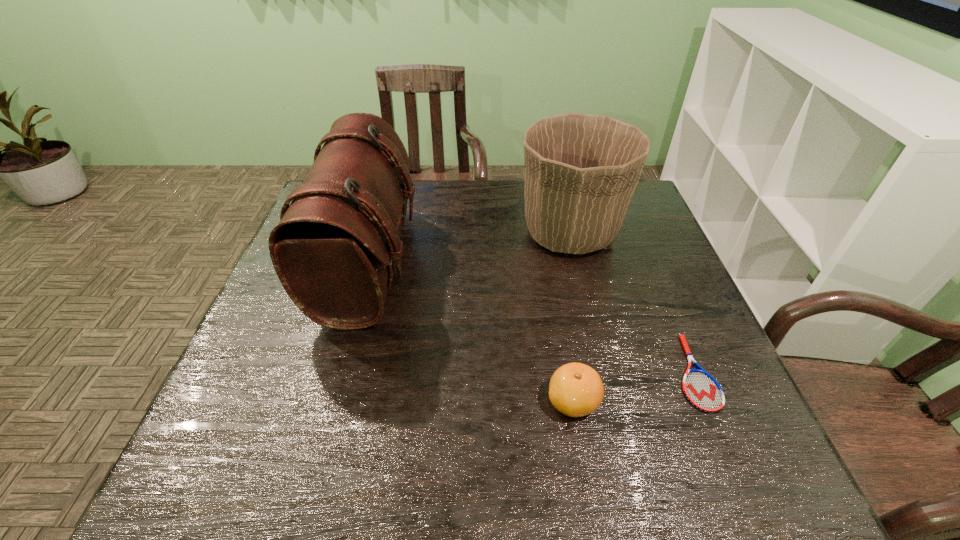
Find the location of a particular element. The height and width of the screenshot is (540, 960). empty location between the satchel and the tennis racket is located at coordinates (531, 319).

What are the coordinates of `unoccupied area between the satchel and the third tallest object` in the screenshot? It's located at (470, 333).

Where is `unoccupied area between the leftmost object and the flowerpot`? This screenshot has width=960, height=540. unoccupied area between the leftmost object and the flowerpot is located at coordinates (469, 248).

Where is `vacant space in between the leftmost object and the third tallest object`? vacant space in between the leftmost object and the third tallest object is located at coordinates (470, 333).

Find the location of `unoccupied position between the leftmost object and the tennis racket`. unoccupied position between the leftmost object and the tennis racket is located at coordinates (531, 319).

At what (x,y) coordinates should I click in order to perform the action: click on vacant space that's between the leftmost object and the clementine. Please return your answer as a coordinate pair (x, y). Looking at the image, I should click on (470, 333).

At what (x,y) coordinates should I click in order to perform the action: click on free space between the satchel and the second shortest object. Please return your answer as a coordinate pair (x, y). Looking at the image, I should click on (470, 333).

The height and width of the screenshot is (540, 960). Find the location of `empty space that is in between the flowerpot and the shortest object`. empty space that is in between the flowerpot and the shortest object is located at coordinates (632, 303).

Find the location of a particular element. This screenshot has height=540, width=960. free space between the leftmost object and the flowerpot is located at coordinates (469, 248).

Find the location of a particular element. Image resolution: width=960 pixels, height=540 pixels. vacant space in between the clementine and the tennis racket is located at coordinates (634, 387).